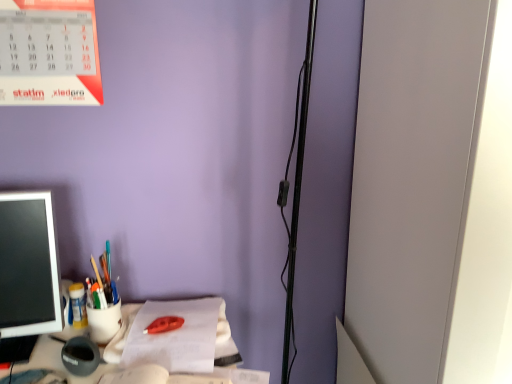
What do you see at coordinates (104, 322) in the screenshot? The image size is (512, 384). I see `matte plastic pen holder at left, the third stationery when ordered from front to back` at bounding box center [104, 322].

What are the coordinates of `matte plastic pen holder at left, the 2th stationery when ordered from back to front` in the screenshot? It's located at (104, 322).

Locate an element on the screen. The image size is (512, 384). matte plastic cup at left, which is the third stationery from back to front is located at coordinates 105,280.

Locate an element on the screen. This screenshot has height=384, width=512. matte plastic cup at left, placed as the first stationery when sorted from back to front is located at coordinates (77, 306).

The height and width of the screenshot is (384, 512). What are the coordinates of `white paper at center` in the screenshot? It's located at (175, 336).

Based on the photo, from the image's perspective, which one is positioned higher, matte plastic pen holder at left, the 2th stationery when ordered from back to front, or white paper at center?

matte plastic pen holder at left, the 2th stationery when ordered from back to front, is shown above in the image.

In the image, is matte plastic pen holder at left, the 2th stationery when ordered from back to front, positioned in front of or behind white paper at center?

matte plastic pen holder at left, the 2th stationery when ordered from back to front, is behind white paper at center.

Are matte plastic pen holder at left, the third stationery when ordered from front to back, and white paper at center beside each other?

No, matte plastic pen holder at left, the third stationery when ordered from front to back, is not with white paper at center.

At what (x,y) coordinates should I click in order to perform the action: click on office supplies above the matte plastic cup at left, which is the third stationery from back to front (from a real-world perspective). Please return your answer as a coordinate pair (x, y). Image resolution: width=512 pixels, height=384 pixels. Looking at the image, I should click on (27, 273).

In the scene shown: From the image's perspective, which one is positioned higher, matte plastic pen holder at left or matte plastic cup at left, which is the third stationery from back to front?

matte plastic pen holder at left.

Is matte plastic pen holder at left completely or partially outside of matte plastic cup at left, which is the third stationery from back to front?

Yes, matte plastic pen holder at left is located beyond the bounds of matte plastic cup at left, which is the third stationery from back to front.

From the matte plastic pen holder at left, count 3rd stationery to the right and point to it. Please provide its 2D coordinates.

[(104, 322)]

In the image, is matte plastic pen holder at left on the left side or the right side of matte plastic pen holder at left, the 2th stationery when ordered from back to front?

Based on their positions, matte plastic pen holder at left is located to the left of matte plastic pen holder at left, the 2th stationery when ordered from back to front.

Can you confirm if matte plastic pen holder at left is shorter than matte plastic pen holder at left, the 2th stationery when ordered from back to front?

In fact, matte plastic pen holder at left may be taller than matte plastic pen holder at left, the 2th stationery when ordered from back to front.

Choose the correct answer: Is matte plastic pen holder at left inside matte plastic pen holder at left, the 2th stationery when ordered from back to front, or outside it?

matte plastic pen holder at left is not inside matte plastic pen holder at left, the 2th stationery when ordered from back to front, it's outside.

Choose the correct answer: Is white paper at center inside matte plastic cup at left, placed as the first stationery when sorted from back to front, or outside it?

white paper at center cannot be found inside matte plastic cup at left, placed as the first stationery when sorted from back to front.

From the image's perspective, between white paper at center and matte plastic cup at left, placed as the first stationery when sorted from back to front, who is located below?

white paper at center appears lower in the image.

Does point (194, 326) appear closer or farther from the camera than point (72, 284)?

Clearly, point (194, 326) is closer to the camera than point (72, 284).

Is white paper at center to the left or to the right of matte plastic cup at left, the fourth stationery when ordered from front to back, in the image?

In the image, white paper at center appears on the right side of matte plastic cup at left, the fourth stationery when ordered from front to back.

How different are the orientations of matte black mouse at lower left, the first stationery viewed from the front, and matte plastic pen holder at left, the 2th stationery when ordered from back to front, in degrees?

matte black mouse at lower left, the first stationery viewed from the front, and matte plastic pen holder at left, the 2th stationery when ordered from back to front, are facing 5.65e-05 degrees away from each other.

Which object is positioned more to the left, matte black mouse at lower left, the first stationery viewed from the front, or matte plastic pen holder at left, the 2th stationery when ordered from back to front?

From the viewer's perspective, matte black mouse at lower left, the first stationery viewed from the front, appears more on the left side.

Is point (80, 354) positioned before point (112, 330)?

Yes.

Can you confirm if matte plastic pen holder at left, the third stationery when ordered from front to back, is shorter than matte black mouse at lower left, acting as the 4th stationery starting from the back?

No.

The width and height of the screenshot is (512, 384). I want to click on the 2nd stationery in front of the matte plastic pen holder at left, the 2th stationery when ordered from back to front, so click(80, 356).

From a real-world perspective, is matte plastic pen holder at left, the 2th stationery when ordered from back to front, above or below matte black mouse at lower left, acting as the 4th stationery starting from the back?

In terms of real-world spatial position, matte plastic pen holder at left, the 2th stationery when ordered from back to front, is above matte black mouse at lower left, acting as the 4th stationery starting from the back.

Looking at their sizes, would you say matte plastic cup at left, which ranks as the 2th stationery in front-to-back order, is wider or thinner than matte plastic cup at left, the fourth stationery when ordered from front to back?

Considering their sizes, matte plastic cup at left, which ranks as the 2th stationery in front-to-back order, looks broader than matte plastic cup at left, the fourth stationery when ordered from front to back.

Is matte plastic cup at left, which ranks as the 2th stationery in front-to-back order, bigger than matte plastic cup at left, placed as the first stationery when sorted from back to front?

Yes.

Which is more to the right, matte plastic cup at left, which is the third stationery from back to front, or matte plastic cup at left, the fourth stationery when ordered from front to back?

Positioned to the right is matte plastic cup at left, which is the third stationery from back to front.

This screenshot has height=384, width=512. I want to click on stationery above the matte plastic cup at left, the fourth stationery when ordered from front to back (from a real-world perspective), so click(105, 280).

At what (x,y) coordinates should I click in order to perform the action: click on notebook located underneath the matte plastic pen holder at left, the 2th stationery when ordered from back to front (from a real-world perspective). Please return your answer as a coordinate pair (x, y). Looking at the image, I should click on (175, 336).

The width and height of the screenshot is (512, 384). I want to click on office supplies in front of the matte plastic cup at left, which ranks as the 2th stationery in front-to-back order, so click(x=27, y=273).

Estimate the real-world distances between objects in this image. Which object is closer to matte plastic pen holder at left, the third stationery when ordered from front to back, matte plastic cup at left, the fourth stationery when ordered from front to back, or matte black mouse at lower left, the first stationery viewed from the front?

matte black mouse at lower left, the first stationery viewed from the front, lies closer to matte plastic pen holder at left, the third stationery when ordered from front to back, than the other object.

Estimate the real-world distances between objects in this image. Which object is further from matte black mouse at lower left, acting as the 4th stationery starting from the back, matte plastic cup at left, which is the third stationery from back to front, or matte plastic pen holder at left?

Based on the image, matte plastic pen holder at left appears to be further to matte black mouse at lower left, acting as the 4th stationery starting from the back.

Looking at this image, which object lies nearer to the anchor point matte plastic pen holder at left, the third stationery when ordered from front to back, matte plastic pen holder at left or white paper at center?

white paper at center lies closer to matte plastic pen holder at left, the third stationery when ordered from front to back, than the other object.

When comparing their distances from matte plastic cup at left, placed as the first stationery when sorted from back to front, does matte plastic pen holder at left, the third stationery when ordered from front to back, or white paper at center seem further?

white paper at center.

Considering their positions, is white paper at center positioned closer to matte plastic pen holder at left, the 2th stationery when ordered from back to front, than matte black mouse at lower left, the first stationery viewed from the front?

Based on the image, matte black mouse at lower left, the first stationery viewed from the front, appears to be nearer to matte plastic pen holder at left, the 2th stationery when ordered from back to front.

Which object lies nearer to the anchor point matte plastic pen holder at left, matte plastic cup at left, which ranks as the 2th stationery in front-to-back order, or matte plastic cup at left, placed as the first stationery when sorted from back to front?

matte plastic cup at left, placed as the first stationery when sorted from back to front, is positioned closer to the anchor matte plastic pen holder at left.

From the image, which object appears to be farther from matte plastic pen holder at left, the 2th stationery when ordered from back to front, white paper at center or matte plastic cup at left, which is the third stationery from back to front?

Based on the image, white paper at center appears to be further to matte plastic pen holder at left, the 2th stationery when ordered from back to front.

From the image, which object appears to be nearer to matte plastic cup at left, placed as the first stationery when sorted from back to front, matte plastic cup at left, which ranks as the 2th stationery in front-to-back order, or white paper at center?

matte plastic cup at left, which ranks as the 2th stationery in front-to-back order, is closer to matte plastic cup at left, placed as the first stationery when sorted from back to front.

Where is `stationery between matte plastic cup at left, which ranks as the 2th stationery in front-to-back order, and matte plastic pen holder at left, the third stationery when ordered from front to back, from top to bottom`? The height and width of the screenshot is (384, 512). stationery between matte plastic cup at left, which ranks as the 2th stationery in front-to-back order, and matte plastic pen holder at left, the third stationery when ordered from front to back, from top to bottom is located at coordinates (77, 306).

At what (x,y) coordinates should I click in order to perform the action: click on stationery between matte plastic pen holder at left, the third stationery when ordered from front to back, and white paper at center. Please return your answer as a coordinate pair (x, y). This screenshot has width=512, height=384. Looking at the image, I should click on (105, 280).